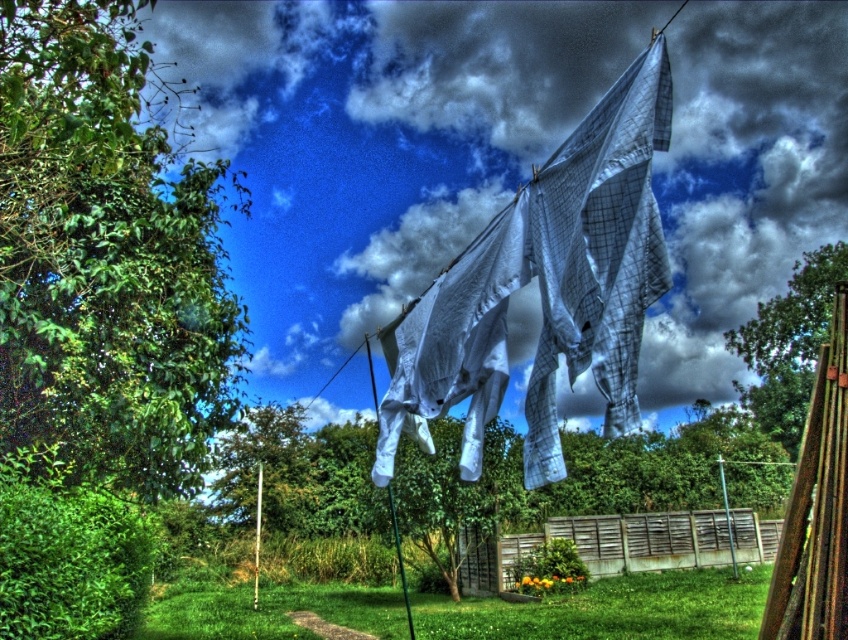
You are standing in the middle of the green grass at lower center and want to walk towards the green leafy tree at upper center. Which direction should you move to reach it?

You should move to the right side from the green grass at lower center to reach the green leafy tree at upper center since the green grass at lower center is positioned on the left side of the green leafy tree at upper center.

You are a gardener looking to plant a new flower bed. You have two areas in mind based on the image. One is near the green grass at lower center and the other near the green leafy tree at upper center. Which area would you choose if you want to plant flowers that require more space to grow?

The green grass at lower center is larger in size than the green leafy tree at upper center, so you should choose the area near the green grass at lower center for planting flowers that need more space.